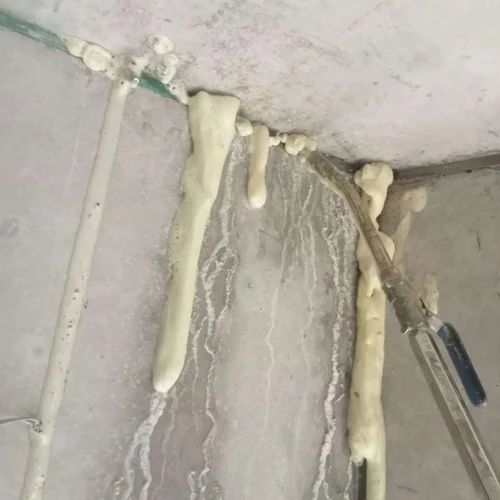
What are the coordinates of `handle` in the screenshot? It's located at [463, 353].